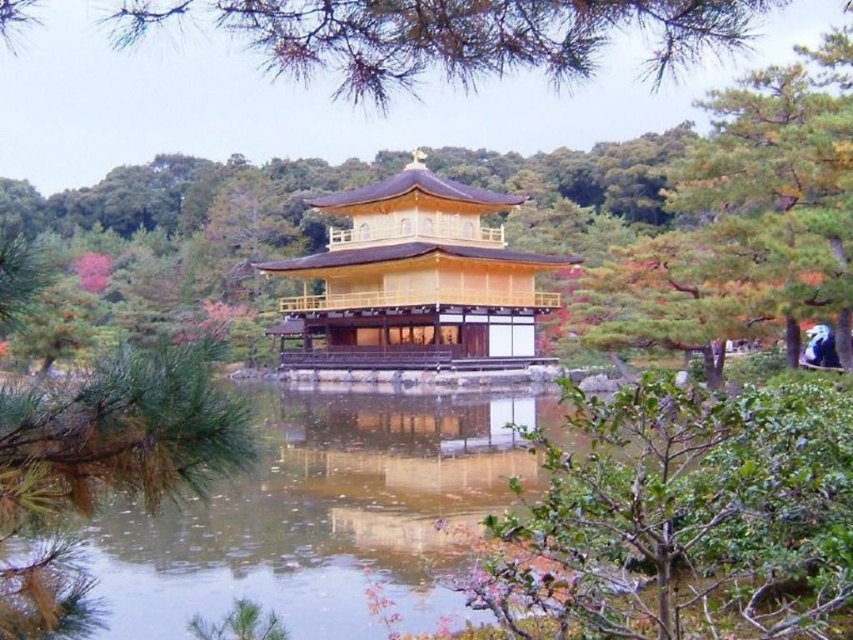
Question: Estimate the real-world distances between objects in this image. Which object is farther from the golden polished wood temple at center?

Choices:
 (A) green needle-like leaves at upper center
 (B) clear water at center

Answer: (A)

Question: Does golden polished wood temple at center have a greater width compared to green needle-like leaves at upper center?

Choices:
 (A) yes
 (B) no

Answer: (B)

Question: Which is farther from the green needle-like leaves at upper center?

Choices:
 (A) golden polished wood temple at center
 (B) clear water at center

Answer: (A)

Question: Based on their relative distances, which object is farther from the golden polished wood temple at center?

Choices:
 (A) clear water at center
 (B) green needle-like leaves at upper center

Answer: (B)

Question: Is golden polished wood temple at center bigger than green needle-like leaves at upper center?

Choices:
 (A) yes
 (B) no

Answer: (B)

Question: Does golden polished wood temple at center have a smaller size compared to green needle-like leaves at upper center?

Choices:
 (A) yes
 (B) no

Answer: (A)